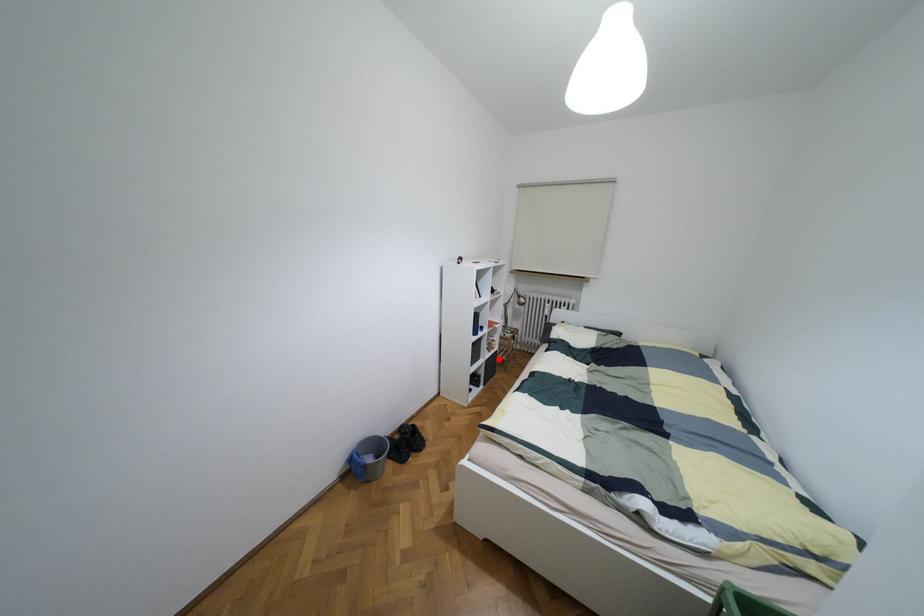
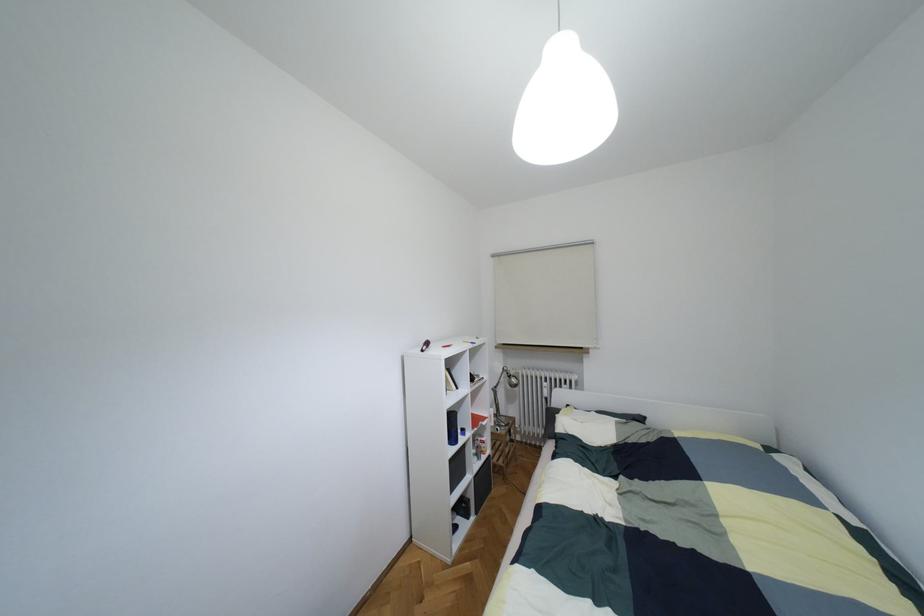
Find the pixel in the second image that matches the highlighted location in the first image.

(493, 464)